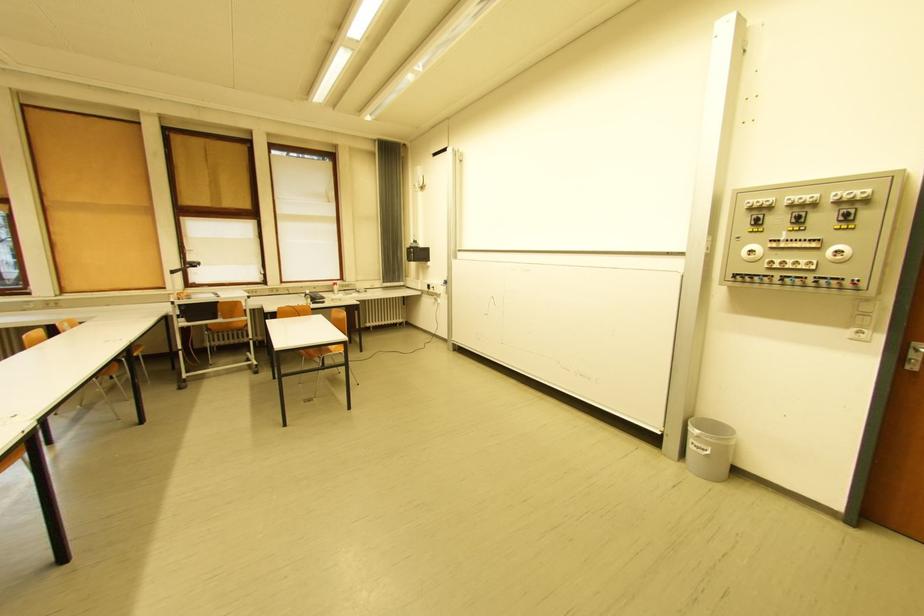
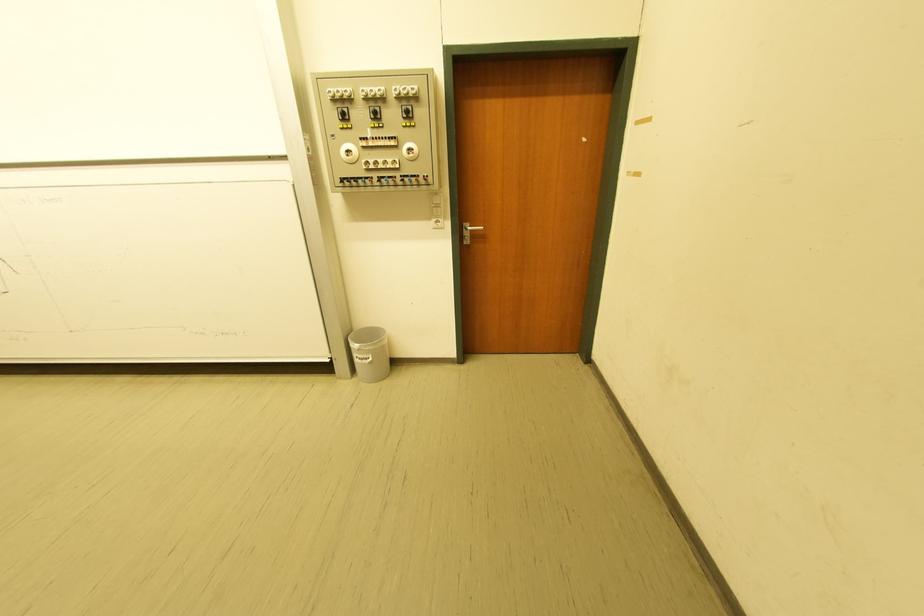
The point at (752, 223) is marked in the first image. Where is the corresponding point in the second image?

(342, 116)